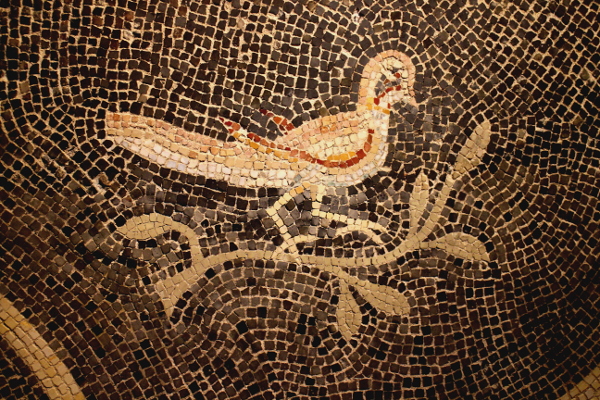
You are a GUI agent. You are given a task and a screenshot of the screen. Output one action in this format:
    pyautogui.click(x=<x>, y=<y>)
    Task: Click on the black tile
    Image resolution: width=600 pixels, height=400 pixels.
    Given the screenshot: What is the action you would take?
    pyautogui.click(x=540, y=329)